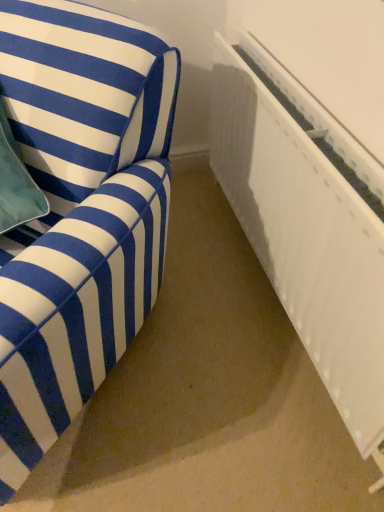
In order to face white plastic radiator at right, should I rotate leftwards or rightwards?

Turn right approximately 12.865 degrees to face it.

Locate an element on the screen. white plastic radiator at right is located at coordinates (308, 223).

Describe the element at coordinates (308, 223) in the screenshot. The width and height of the screenshot is (384, 512). I see `white plastic radiator at right` at that location.

Locate an element on the screen. Image resolution: width=384 pixels, height=512 pixels. blue striped fabric sofa at left is located at coordinates (78, 211).

The width and height of the screenshot is (384, 512). Describe the element at coordinates (78, 211) in the screenshot. I see `blue striped fabric sofa at left` at that location.

What is the approximate width of blue striped fabric sofa at left?

81.03 centimeters.

Locate an element on the screen. This screenshot has width=384, height=512. white plastic radiator at right is located at coordinates click(308, 223).

Is white plastic radiator at right to the right of blue striped fabric sofa at left from the viewer's perspective?

Indeed, white plastic radiator at right is positioned on the right side of blue striped fabric sofa at left.

Considering the relative positions of white plastic radiator at right and blue striped fabric sofa at left in the image provided, is white plastic radiator at right in front of blue striped fabric sofa at left?

No, it is not.

Which is in front, point (363, 404) or point (2, 407)?

Point (2, 407)

From the image's perspective, which one is positioned lower, white plastic radiator at right or blue striped fabric sofa at left?

blue striped fabric sofa at left appears lower in the image.

From a real-world perspective, is white plastic radiator at right under blue striped fabric sofa at left?

A: Yes.

Is white plastic radiator at right wider than blue striped fabric sofa at left?

In fact, white plastic radiator at right might be narrower than blue striped fabric sofa at left.

Is white plastic radiator at right shorter than blue striped fabric sofa at left?

Yes, white plastic radiator at right is shorter than blue striped fabric sofa at left.

Considering the relative sizes of white plastic radiator at right and blue striped fabric sofa at left in the image provided, is white plastic radiator at right bigger than blue striped fabric sofa at left?

No.

Which is correct: white plastic radiator at right is inside blue striped fabric sofa at left, or outside of it?

white plastic radiator at right is not enclosed by blue striped fabric sofa at left.

Are white plastic radiator at right and blue striped fabric sofa at left far apart?

No, there isn't a large distance between white plastic radiator at right and blue striped fabric sofa at left.

Is white plastic radiator at right aimed at blue striped fabric sofa at left?

Yes, white plastic radiator at right faces towards blue striped fabric sofa at left.

Measure the distance from white plastic radiator at right to blue striped fabric sofa at left.

They are 18.12 inches apart.

This screenshot has height=512, width=384. What are the coordinates of `radiator above the blue striped fabric sofa at left (from the image's perspective)` in the screenshot? It's located at (308, 223).

Considering the relative positions of blue striped fabric sofa at left and white plastic radiator at right in the image provided, is blue striped fabric sofa at left to the right of white plastic radiator at right from the viewer's perspective?

Incorrect, blue striped fabric sofa at left is not on the right side of white plastic radiator at right.

Is blue striped fabric sofa at left positioned before white plastic radiator at right?

Yes, it is in front of white plastic radiator at right.

Considering the points (61, 109) and (244, 76), which point is in front, point (61, 109) or point (244, 76)?

Point (61, 109)

From the image's perspective, is blue striped fabric sofa at left beneath white plastic radiator at right?

Yes, from the image's perspective, blue striped fabric sofa at left is beneath white plastic radiator at right.

From a real-world perspective, is blue striped fabric sofa at left positioned over white plastic radiator at right based on gravity?

Indeed, from a real-world perspective, blue striped fabric sofa at left stands above white plastic radiator at right.

Can you confirm if blue striped fabric sofa at left is wider than white plastic radiator at right?

Correct, the width of blue striped fabric sofa at left exceeds that of white plastic radiator at right.

Which of these two, blue striped fabric sofa at left or white plastic radiator at right, stands taller?

blue striped fabric sofa at left.

Can you confirm if blue striped fabric sofa at left is bigger than white plastic radiator at right?

Indeed, blue striped fabric sofa at left has a larger size compared to white plastic radiator at right.

Would you say blue striped fabric sofa at left is inside or outside white plastic radiator at right?

blue striped fabric sofa at left is not enclosed by white plastic radiator at right.

Based on the photo, would you say blue striped fabric sofa at left is a long distance from white plastic radiator at right?

No, there isn't a large distance between blue striped fabric sofa at left and white plastic radiator at right.

Is blue striped fabric sofa at left facing towards white plastic radiator at right?

No, blue striped fabric sofa at left is not facing towards white plastic radiator at right.

This screenshot has height=512, width=384. What are the coordinates of `radiator above the blue striped fabric sofa at left (from the image's perspective)` in the screenshot? It's located at (308, 223).

What are the coordinates of `radiator behind the blue striped fabric sofa at left` in the screenshot? It's located at (308, 223).

This screenshot has width=384, height=512. In order to click on furniture to the left of white plastic radiator at right in this screenshot , I will do `click(78, 211)`.